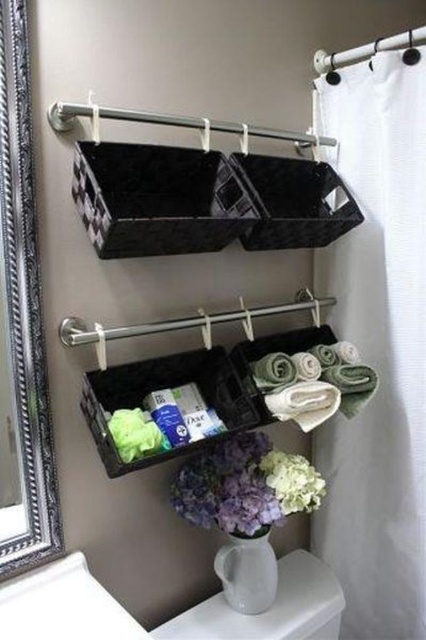
Question: Can you confirm if white glossy toilet bowl at lower center is positioned above green fuzzy flower at lower center?

Choices:
 (A) yes
 (B) no

Answer: (B)

Question: Which of these objects is positioned closest to the translucent plastic organizer at center?

Choices:
 (A) silver ornate mirror at left
 (B) purple matte flower at lower center

Answer: (B)

Question: Which object is the farthest from the purple matte flower at lower center?

Choices:
 (A) white matte toiletries at center
 (B) white fabric curtain at right
 (C) green fuzzy flower at lower center

Answer: (B)

Question: Is silver ornate mirror at left to the right of translucent plastic organizer at center from the viewer's perspective?

Choices:
 (A) no
 (B) yes

Answer: (A)

Question: Is white matte vase at lower center closer to the viewer compared to white matte toiletries at center?

Choices:
 (A) yes
 (B) no

Answer: (B)

Question: Which point is closer to the camera taking this photo?

Choices:
 (A) (215, 435)
 (B) (250, 563)
 (C) (227, 456)

Answer: (A)